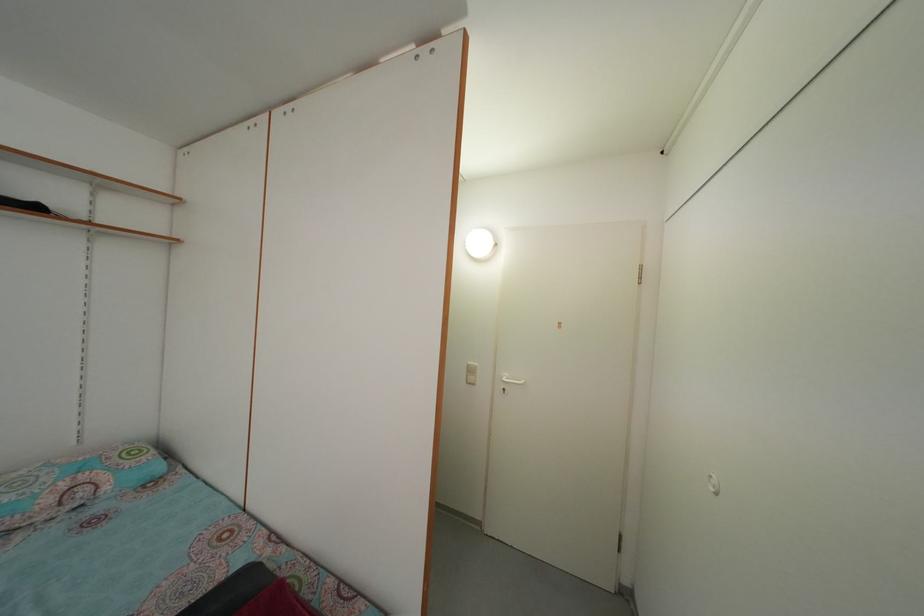
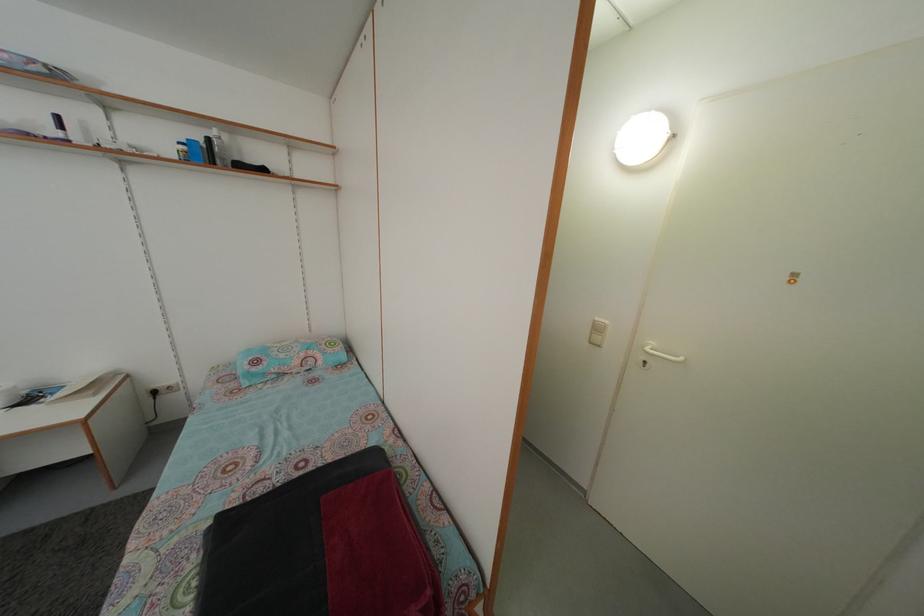
Find the pixel in the second image that matches the point at 509,397 in the first image.

(650, 370)